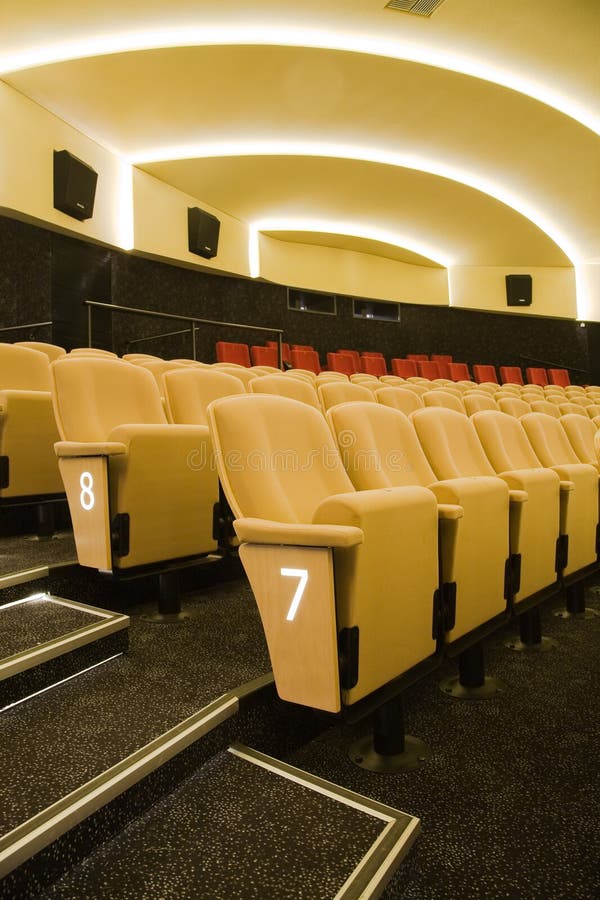
Where is `handle rails in movie theater`? handle rails in movie theater is located at coordinates (543, 360), (22, 326), (165, 334), (163, 313).